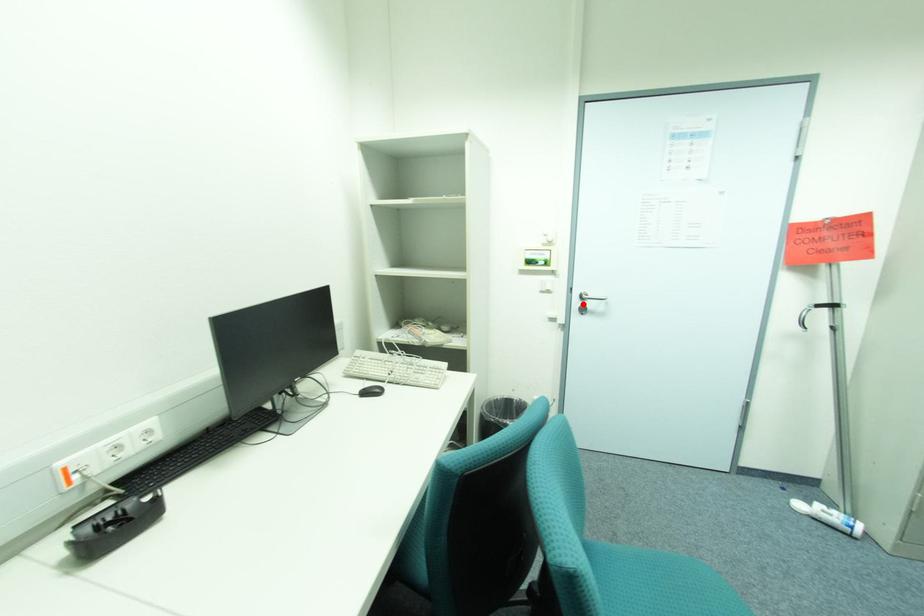
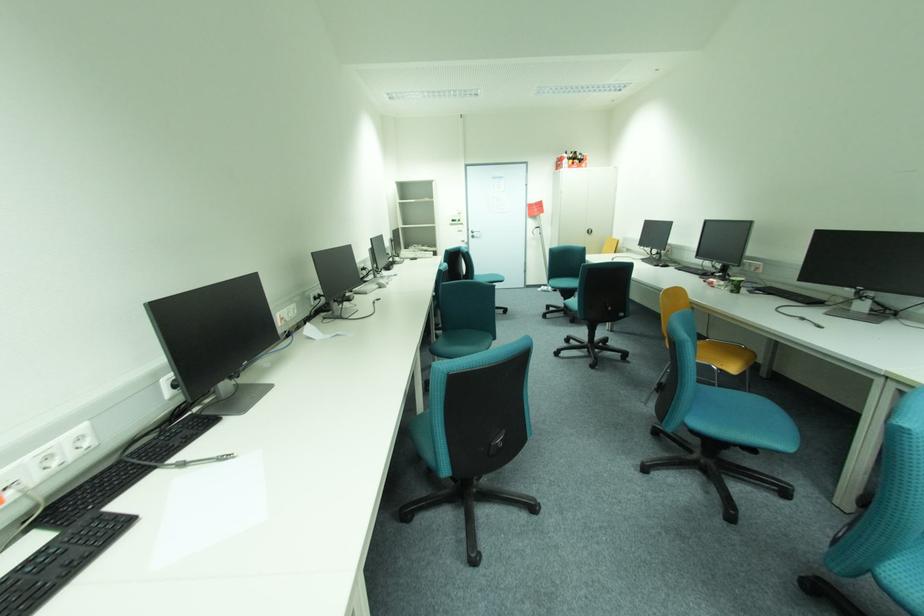
Find the pixel in the second image that matches the highlighted location in the first image.

(477, 235)